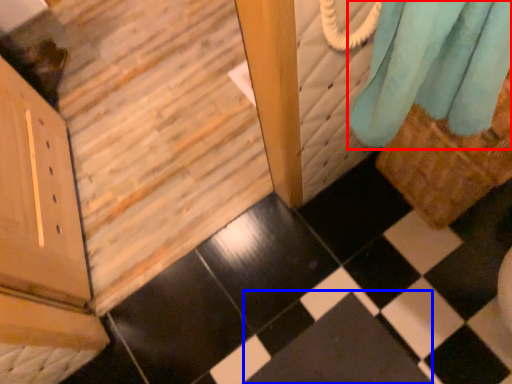
Question: Which of the following is the farthest to the observer, curtain (highlighted by a red box) or square (highlighted by a blue box)?

Choices:
 (A) curtain
 (B) square

Answer: (B)